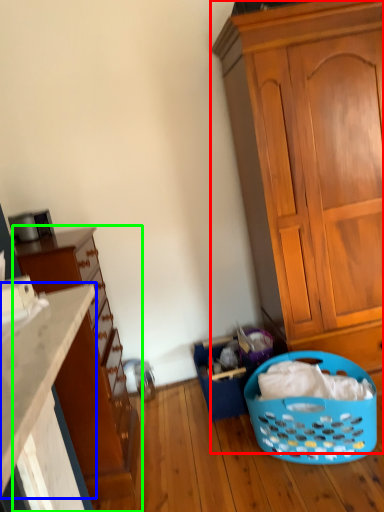
Question: Which is farther away from cabinetry (highlighted by a red box)? countertop (highlighted by a blue box) or cupboard (highlighted by a green box)?

Choices:
 (A) countertop
 (B) cupboard

Answer: (A)